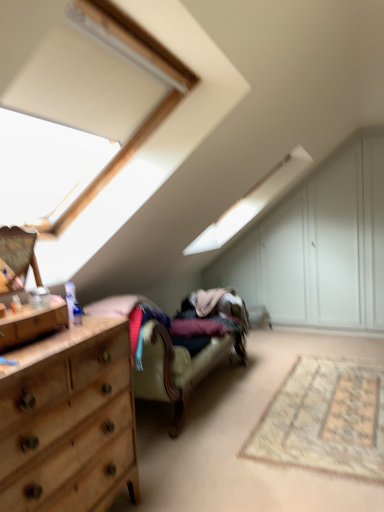
Image resolution: width=384 pixels, height=512 pixels. What are the coordinates of `spots to the right of wooden dresser at left` in the screenshot? It's located at (80, 332).